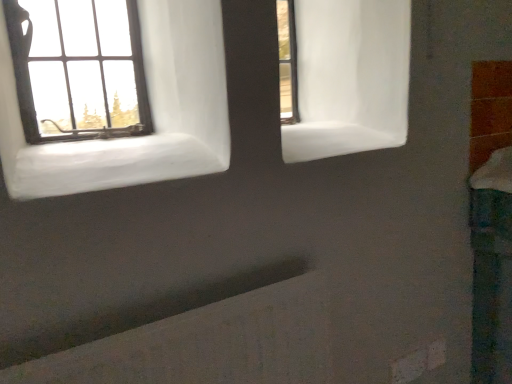
Measure the distance between point (101, 102) and camera.

Point (101, 102) and camera are 3.58 feet apart.

Locate an element on the screen. matte black window at upper left is located at coordinates (78, 69).

Image resolution: width=512 pixels, height=384 pixels. What do you see at coordinates (78, 69) in the screenshot? I see `matte black window at upper left` at bounding box center [78, 69].

Where is `matte black window at upper left`? This screenshot has width=512, height=384. matte black window at upper left is located at coordinates (78, 69).